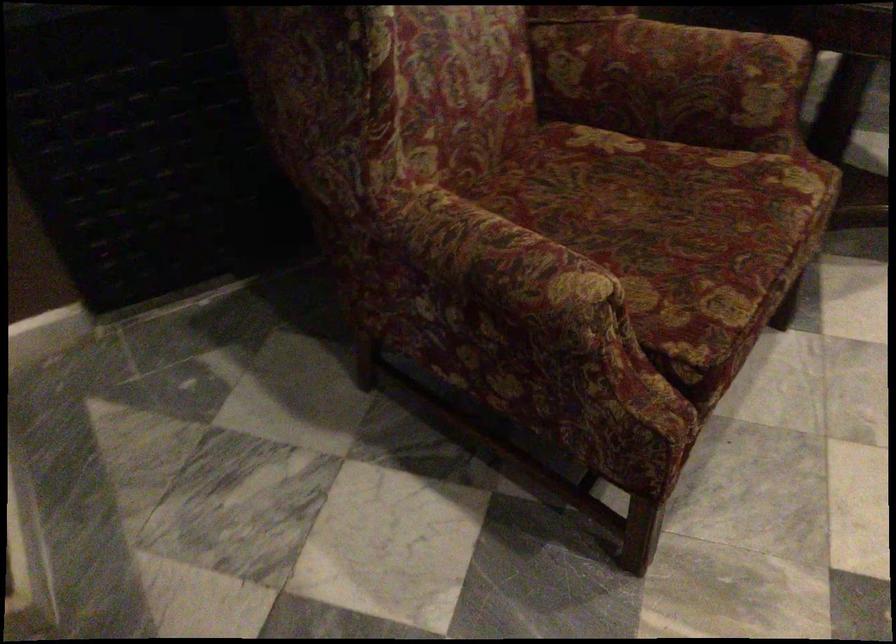
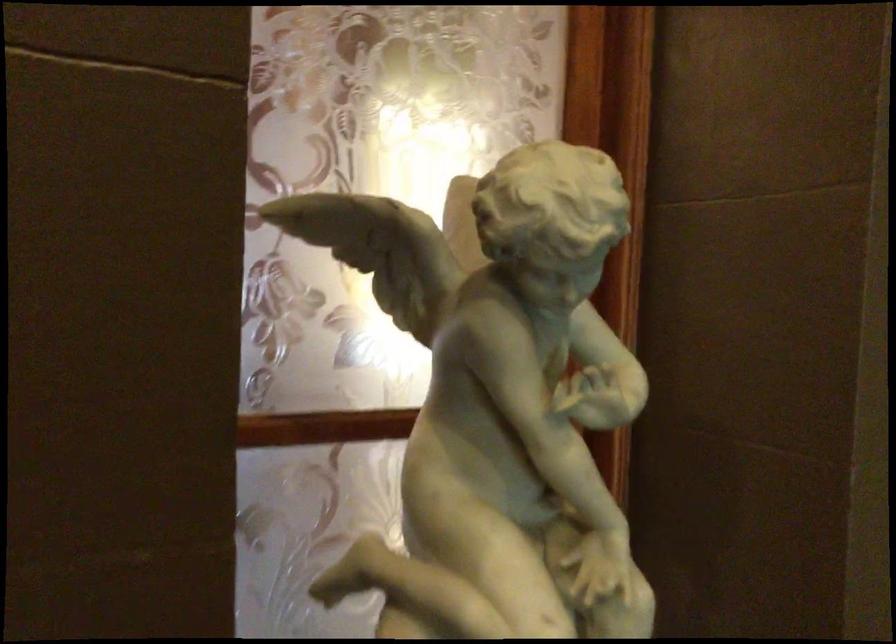
Question: The camera is either moving clockwise (left) or counter-clockwise (right) around the object. The first image is from the beginning of the video and the second image is from the end. Is the camera moving left or right when shooting the video?

Choices:
 (A) Left
 (B) Right

Answer: (B)